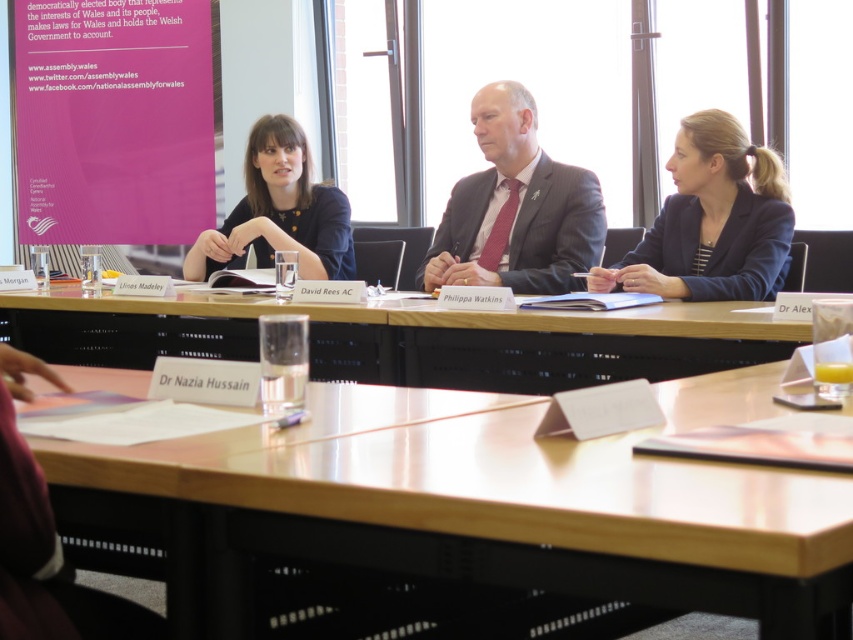
Is wooden table at center below matte black shirt at center?

Yes.

The height and width of the screenshot is (640, 853). Identify the location of wooden table at center. (413, 339).

Is point (704, 321) behind point (285, 202)?

No, (704, 321) is in front of (285, 202).

Locate an element on the screen. The height and width of the screenshot is (640, 853). wooden table at center is located at coordinates (413, 339).

Who is more forward, (670, 499) or (756, 268)?

Positioned in front is point (670, 499).

Does wooden table at lower left have a greater height compared to dark blue blazer at center?

Incorrect, wooden table at lower left's height is not larger of dark blue blazer at center's.

Is point (161, 456) more distant than point (753, 193)?

No, (161, 456) is closer to viewer.

Where is `wooden table at lower left`? The height and width of the screenshot is (640, 853). wooden table at lower left is located at coordinates (479, 509).

Is wooden table at lower left smaller than matte black suit at center?

No, wooden table at lower left is not smaller than matte black suit at center.

Between wooden table at lower left and matte black suit at center, which one is positioned lower?

Positioned lower is wooden table at lower left.

This screenshot has height=640, width=853. What do you see at coordinates (479, 509) in the screenshot? I see `wooden table at lower left` at bounding box center [479, 509].

At what (x,y) coordinates should I click in order to perform the action: click on wooden table at lower left. Please return your answer as a coordinate pair (x, y). Looking at the image, I should click on (479, 509).